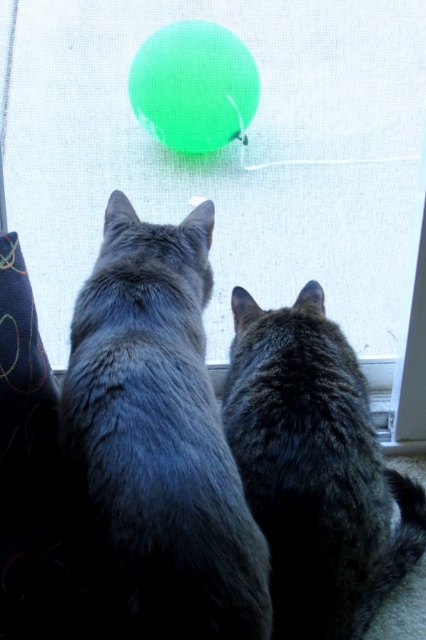
You are a cat owner who wants to buy a toy for your cat. You see the dark gray fur cat at center and the green rubber ball at upper center in the image. Which one is larger?

The dark gray fur cat at center is bigger than the green rubber ball at upper center.

You are a photographer trying to focus on two points in the image. The first point is point (154,496) and the second is point (279,513). Which point is closer to your camera?

Point (154,496) is closer to the camera than point (279,513).

You are a photographer trying to capture the green balloon outside the window. You notice a point at coordinates point [235,161] that might block your shot. Is this point part of an object that could obstruct your view of the green balloon?

The point at coordinates point [235,161] marks the transparent plastic screen door at upper center, which is made of transparent material. Since it is transparent, it wonobstruct your view of the green balloon.